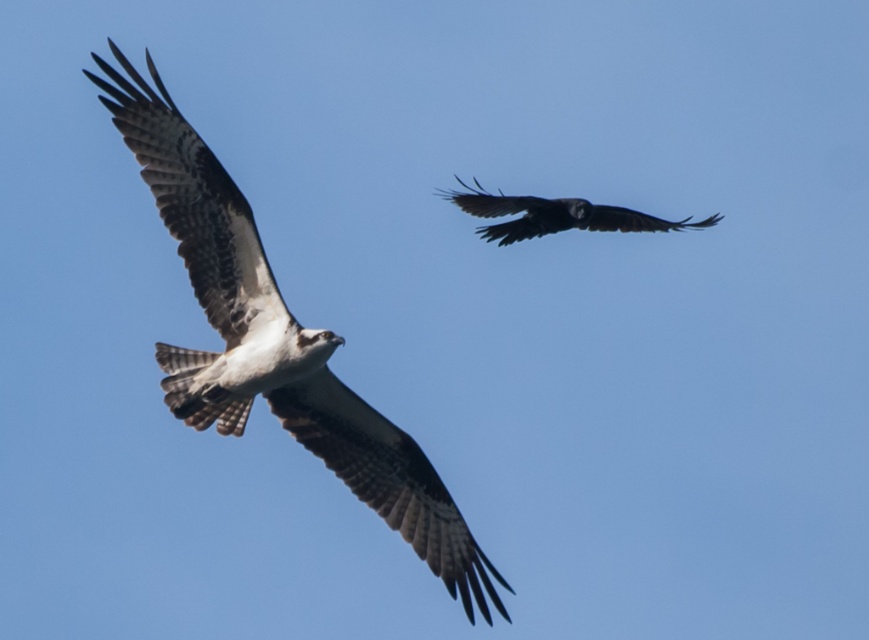
Can you confirm if brown speckled feathers at center is positioned below dark glossy raven at upper center?

Correct, brown speckled feathers at center is located below dark glossy raven at upper center.

Is point (263, 378) less distant than point (641, 227)?

Yes, it is.

Identify the location of brown speckled feathers at center. (277, 344).